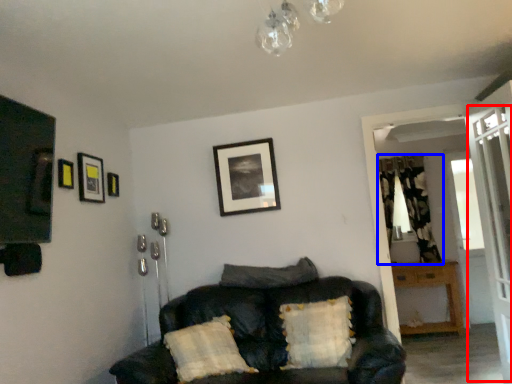
Question: Which of the following is the farthest to the observer, screen door (highlighted by a red box) or curtain (highlighted by a blue box)?

Choices:
 (A) screen door
 (B) curtain

Answer: (B)